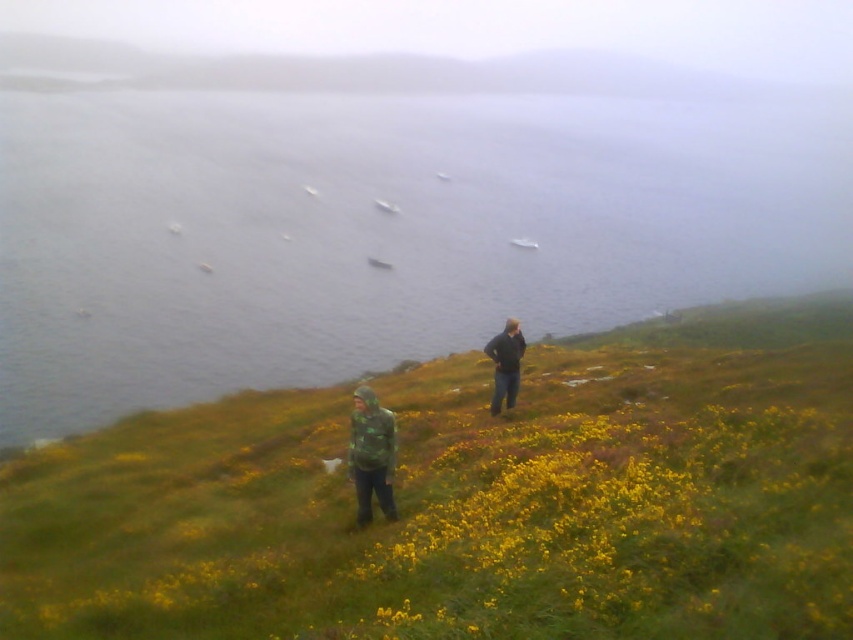
Question: Is green grassy at lower center positioned in front of yellow matte flowers at center?

Choices:
 (A) no
 (B) yes

Answer: (B)

Question: Is gray water at center to the left of camouflage jacket at lower center from the viewer's perspective?

Choices:
 (A) no
 (B) yes

Answer: (A)

Question: Is yellow matte flowers at center wider than dark blue jeans at center?

Choices:
 (A) no
 (B) yes

Answer: (A)

Question: Based on their relative distances, which object is farther from the yellow matte flowers at center?

Choices:
 (A) gray water at center
 (B) dark blue jeans at center

Answer: (A)

Question: Which object is farther from the camera taking this photo?

Choices:
 (A) yellow matte flowers at center
 (B) dark blue jeans at center
 (C) gray water at center

Answer: (C)

Question: Estimate the real-world distances between objects in this image. Which object is closer to the dark blue jeans at center?

Choices:
 (A) camouflage jacket at lower center
 (B) yellow matte flowers at center

Answer: (B)